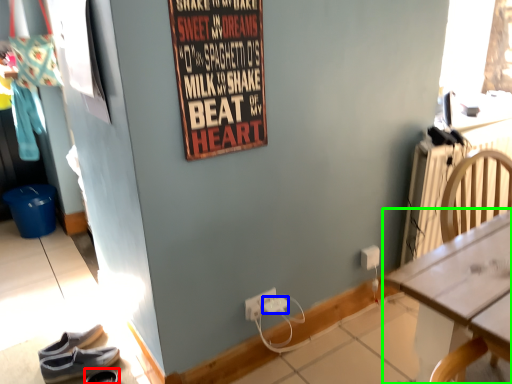
Question: Which object is positioned farthest from footwear (highlighted by a red box)? Select from power outlet (highlighted by a blue box) and desk (highlighted by a green box).

Choices:
 (A) power outlet
 (B) desk

Answer: (B)